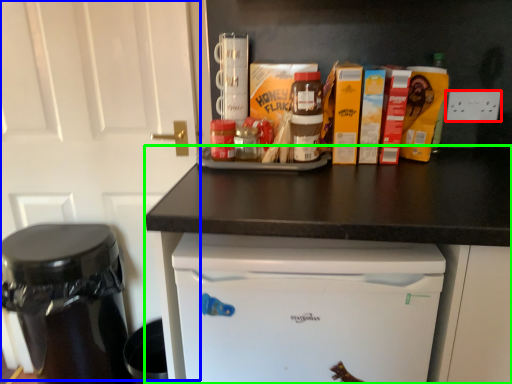
Question: Which is nearer to the electric outlet (highlighted by a red box)? door (highlighted by a blue box) or counter (highlighted by a green box).

Choices:
 (A) door
 (B) counter

Answer: (B)